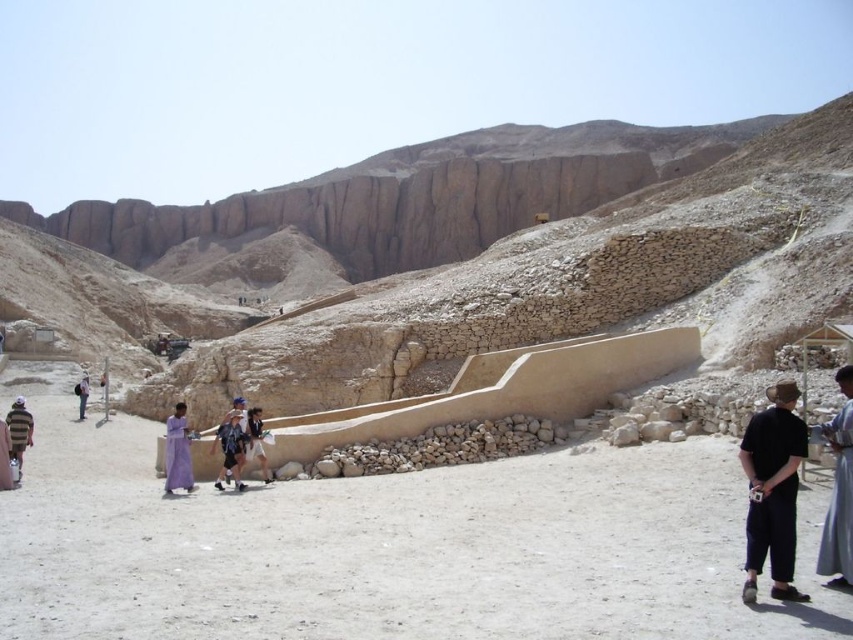
Question: Is dark blue jeans at center to the left of light purple fabric at left from the viewer's perspective?

Choices:
 (A) no
 (B) yes

Answer: (A)

Question: Can you confirm if purple fabric dress at lower left is positioned to the right of light blue fabric backpack at center?

Choices:
 (A) no
 (B) yes

Answer: (A)

Question: Does gray cotton dress at lower right appear over striped cotton shirt at left?

Choices:
 (A) no
 (B) yes

Answer: (B)

Question: Estimate the real-world distances between objects in this image. Which object is closer to the striped cotton shirt at left?

Choices:
 (A) purple fabric dress at lower left
 (B) light purple fabric at left
 (C) gray cotton dress at lower right

Answer: (A)

Question: Estimate the real-world distances between objects in this image. Which object is closer to the gray cotton dress at lower right?

Choices:
 (A) light blue fabric backpack at center
 (B) black cotton shirt at lower right
 (C) dark blue jeans at center

Answer: (B)

Question: Which point is closer to the camera?

Choices:
 (A) light blue fabric backpack at center
 (B) light purple fabric at left
 (C) gray cotton dress at lower right
 (D) black cotton shirt at lower right

Answer: (D)